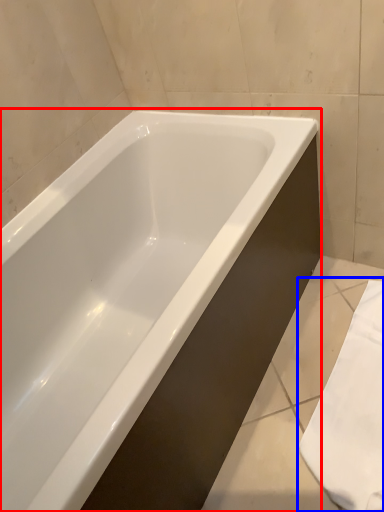
Question: Which point is further to the camera, bathtub (highlighted by a red box) or bath towel (highlighted by a blue box)?

Choices:
 (A) bathtub
 (B) bath towel

Answer: (B)